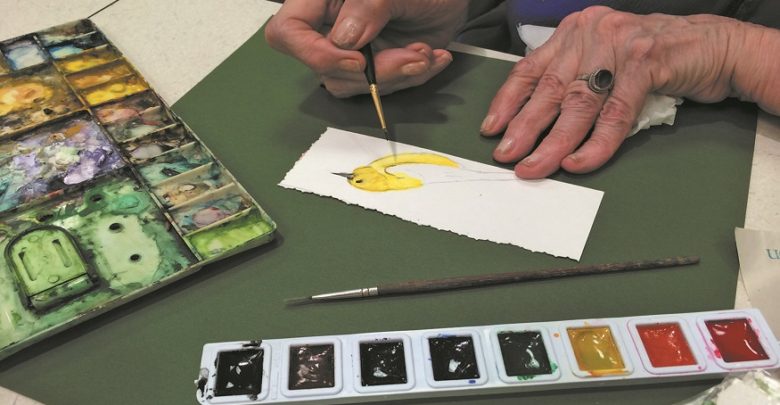
The image size is (780, 405). I want to click on yellow paint, so click(591, 358).